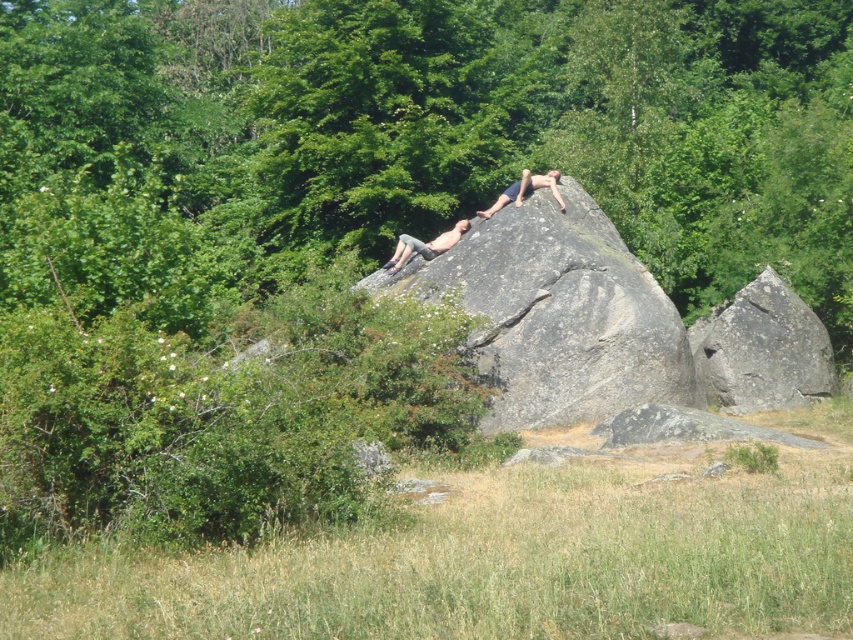
Question: Can you confirm if gray rough rock at center is thinner than smooth gray rock at upper center?

Choices:
 (A) no
 (B) yes

Answer: (A)

Question: Can you confirm if gray rough rock at center is thinner than smooth gray rock at upper center?

Choices:
 (A) yes
 (B) no

Answer: (B)

Question: Which point appears closest to the camera in this image?

Choices:
 (A) (593, 369)
 (B) (412, 237)

Answer: (A)

Question: Which point is closer to the camera taking this photo?

Choices:
 (A) (813, 394)
 (B) (440, 237)

Answer: (B)

Question: Does smooth gray rock at center have a larger size compared to smooth gray rock at upper center?

Choices:
 (A) no
 (B) yes

Answer: (A)

Question: Which object appears farthest from the camera in this image?

Choices:
 (A) gray rough rock at lower right
 (B) smooth gray rock at upper center
 (C) smooth gray rock at center
 (D) skinny jeans at upper center

Answer: (C)